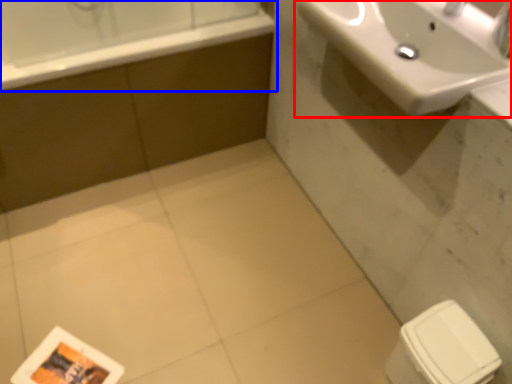
Question: Among these objects, which one is farthest to the camera, sink (highlighted by a red box) or bathtub (highlighted by a blue box)?

Choices:
 (A) sink
 (B) bathtub

Answer: (B)